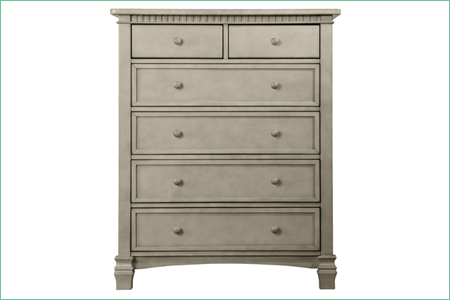
The image size is (450, 300). I want to click on drawer, so click(240, 228), click(231, 188), click(233, 136), click(232, 87), click(253, 43), click(206, 41).